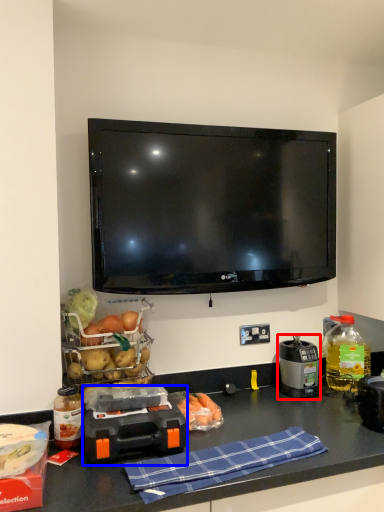
Question: Which object appears farthest to the camera in this image, kitchen appliance (highlighted by a red box) or appliance (highlighted by a blue box)?

Choices:
 (A) kitchen appliance
 (B) appliance

Answer: (A)